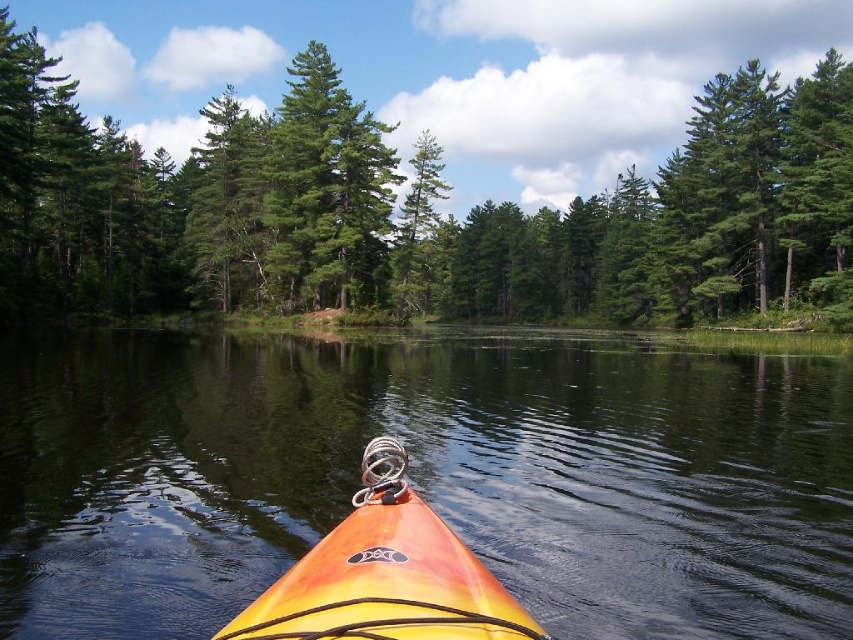
Who is positioned more to the left, transparent water at center or green matte tree at center?

green matte tree at center

Does transparent water at center lie in front of green matte tree at center?

That is True.

At what (x,y) coordinates should I click in order to perform the action: click on transparent water at center. Please return your answer as a coordinate pair (x, y). The width and height of the screenshot is (853, 640). Looking at the image, I should click on tap(424, 476).

Is point (225, 436) closer to camera compared to point (370, 588)?

That is False.

Which of these two, transparent water at center or orange matte kayak at center, stands taller?

With more height is transparent water at center.

Describe the element at coordinates (424, 476) in the screenshot. I see `transparent water at center` at that location.

Where is `transparent water at center`? This screenshot has width=853, height=640. transparent water at center is located at coordinates (424, 476).

Between green matte tree at center and orange matte kayak at center, which one is positioned lower?

orange matte kayak at center

Where is `green matte tree at center`? This screenshot has height=640, width=853. green matte tree at center is located at coordinates (438, 176).